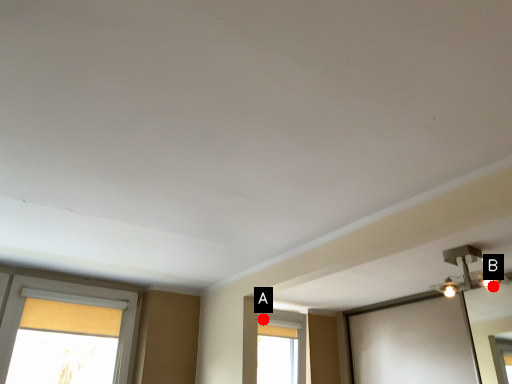
Question: Two points are circled on the image, labeled by A and B beside each circle. Which point is farther from the camera taking this photo?

Choices:
 (A) A is further
 (B) B is further

Answer: (A)